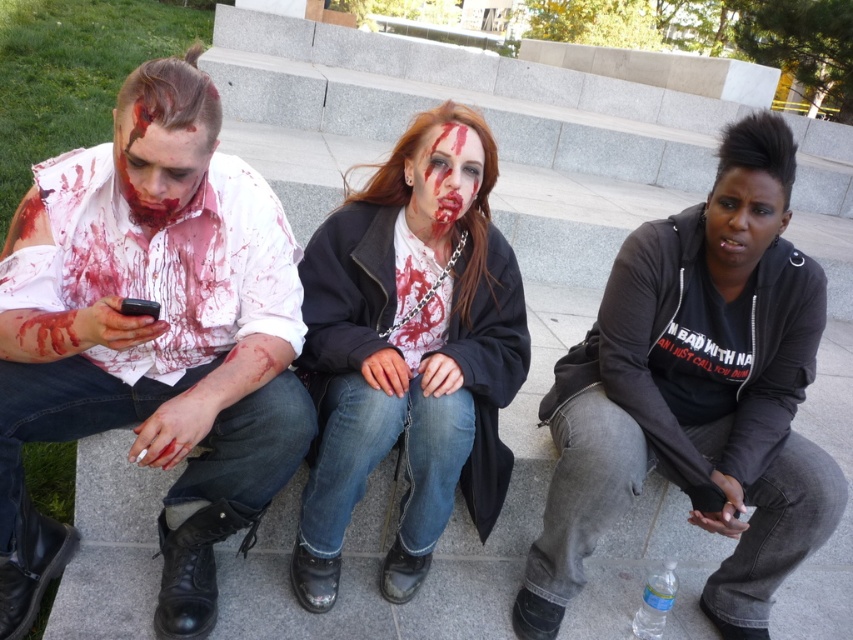
Question: Does matte white face at left have a greater width compared to black matte face at center?

Choices:
 (A) no
 (B) yes

Answer: (B)

Question: Among these objects, which one is farthest from the camera?

Choices:
 (A) matte white face at left
 (B) matte black coat at center
 (C) matte white shirt at left
 (D) black matte face at center

Answer: (D)

Question: Which of the following is the closest to the observer?

Choices:
 (A) black hoodie at center
 (B) blood-stained face at center
 (C) black matte face at center

Answer: (C)

Question: Among these points, which one is nearest to the camera?

Choices:
 (A) (740, 557)
 (B) (474, 173)
 (C) (193, 179)

Answer: (C)

Question: Can you confirm if matte white shirt at left is thinner than matte white face at left?

Choices:
 (A) yes
 (B) no

Answer: (B)

Question: Does matte white shirt at left have a smaller size compared to matte black coat at center?

Choices:
 (A) yes
 (B) no

Answer: (B)